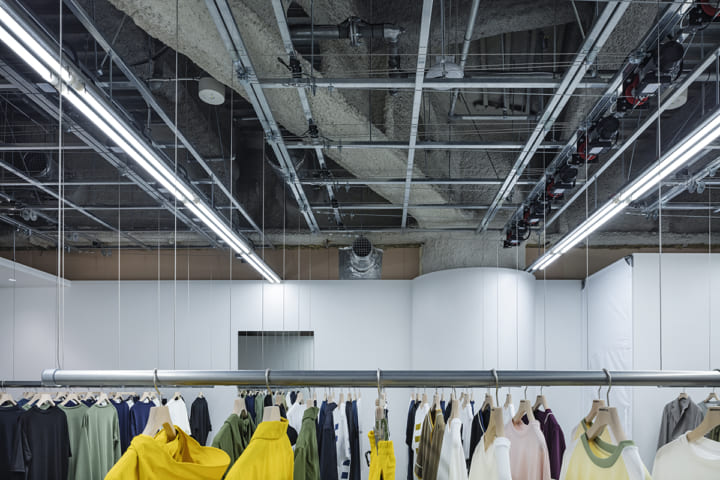
Find the location of a particular element. This screenshot has height=480, width=720. wall is located at coordinates (499, 318).